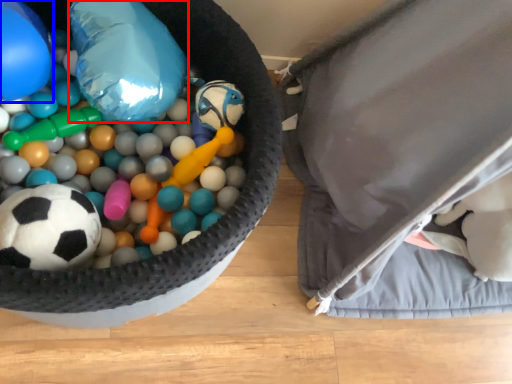
Question: Which object appears farthest to the camera in this image, balloon (highlighted by a red box) or balloon (highlighted by a blue box)?

Choices:
 (A) balloon
 (B) balloon

Answer: (A)